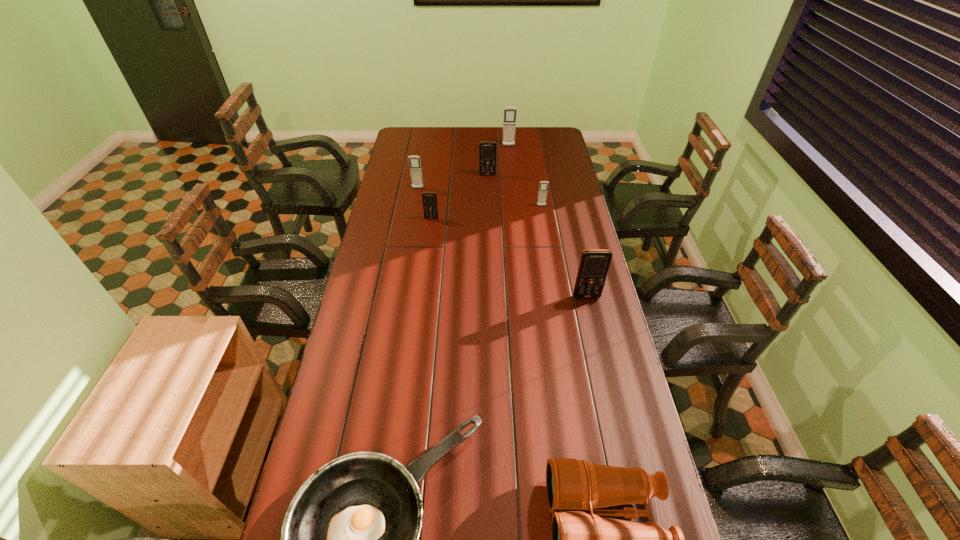
Where is `the rightmost gray cellular telephone`? This screenshot has width=960, height=540. the rightmost gray cellular telephone is located at coordinates (543, 187).

Locate an element on the screen. Image resolution: width=960 pixels, height=540 pixels. the fifth cellular telephone from left to right is located at coordinates (543, 187).

Image resolution: width=960 pixels, height=540 pixels. What are the coordinates of `free space located on the front-facing side of the fourth cellular telephone from left to right` in the screenshot? It's located at (510, 155).

At what (x,y) coordinates should I click in order to perform the action: click on free space located on the screen of the sixth farthest object. Please return your answer as a coordinate pair (x, y). Looking at the image, I should click on (598, 347).

Locate an element on the screen. The height and width of the screenshot is (540, 960). vacant position located on the front-facing side of the second nearest gray cellular telephone is located at coordinates (414, 212).

The image size is (960, 540). Find the location of `blank space located on the screen of the third cellular telephone from left to right`. blank space located on the screen of the third cellular telephone from left to right is located at coordinates (488, 186).

Locate an element on the screen. The image size is (960, 540). vacant space positioned on the screen of the fifth farthest cellular telephone is located at coordinates (426, 260).

Image resolution: width=960 pixels, height=540 pixels. I want to click on vacant region located 0.250m on the front-facing side of the nearest gray cellular telephone, so click(548, 243).

Where is `object that is at the far edge`? The width and height of the screenshot is (960, 540). object that is at the far edge is located at coordinates (509, 124).

Image resolution: width=960 pixels, height=540 pixels. What are the coordinates of `object located at the left edge` in the screenshot? It's located at (414, 161).